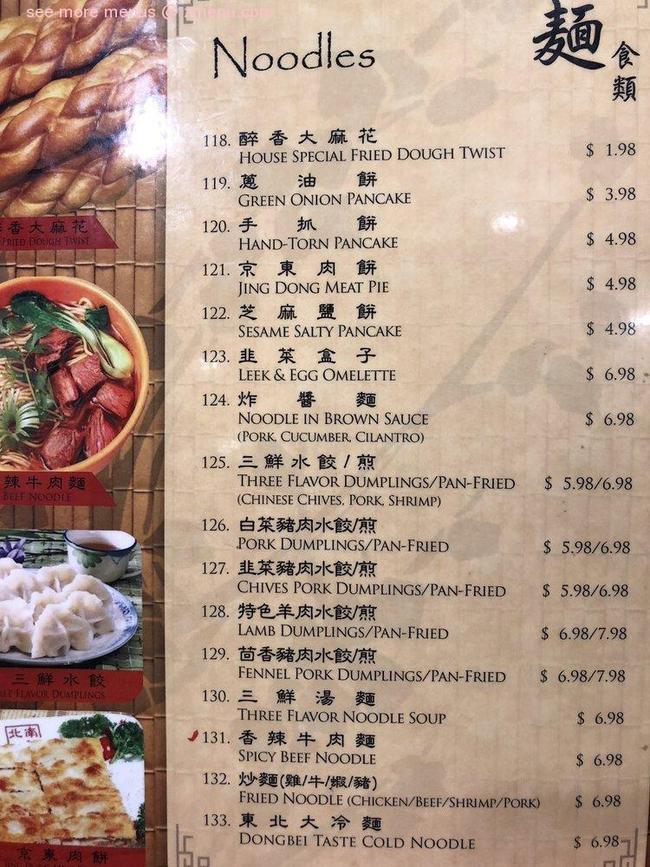
Image resolution: width=650 pixels, height=867 pixels. In order to click on cup handle in this screenshot , I will do `click(136, 571)`.